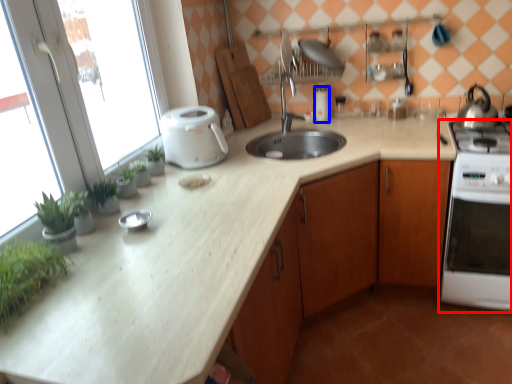
Question: Which point is further to the camera, home appliance (highlighted by a red box) or appliance (highlighted by a blue box)?

Choices:
 (A) home appliance
 (B) appliance

Answer: (B)